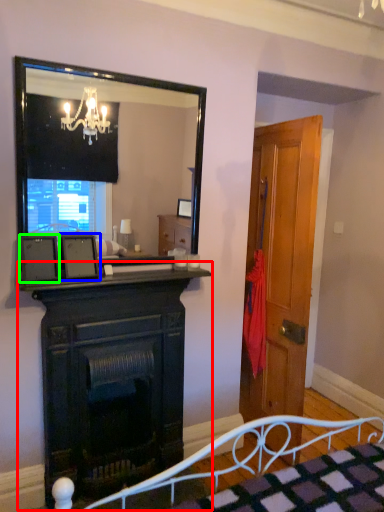
Question: Which is farther away from fireplace (highlighted by a red box)? picture frame (highlighted by a blue box) or picture frame (highlighted by a green box)?

Choices:
 (A) picture frame
 (B) picture frame

Answer: (B)